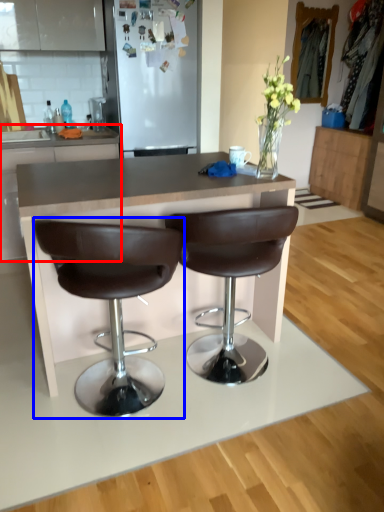
Question: Among these objects, which one is farthest to the camera, cabinetry (highlighted by a red box) or chair (highlighted by a blue box)?

Choices:
 (A) cabinetry
 (B) chair

Answer: (A)